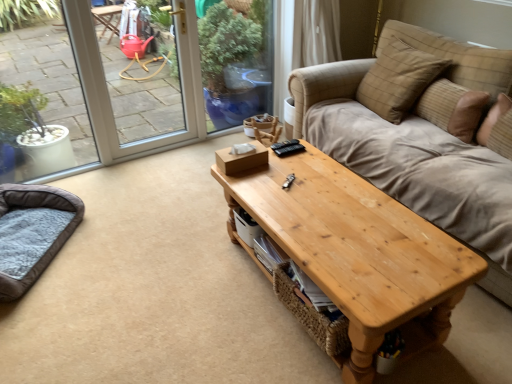
The height and width of the screenshot is (384, 512). Find the location of `spots to the right of dark brown plush cat bed at lower left`. spots to the right of dark brown plush cat bed at lower left is located at coordinates (127, 250).